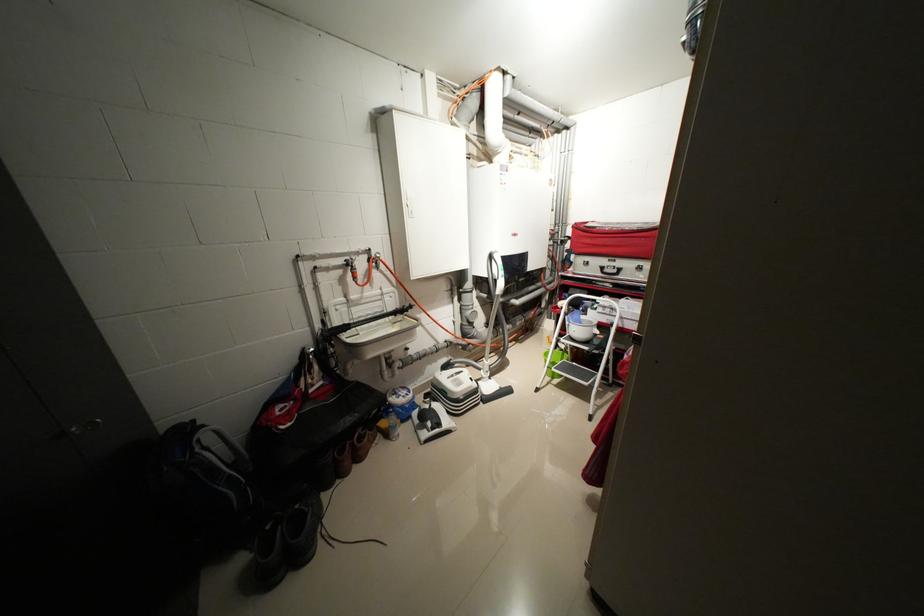
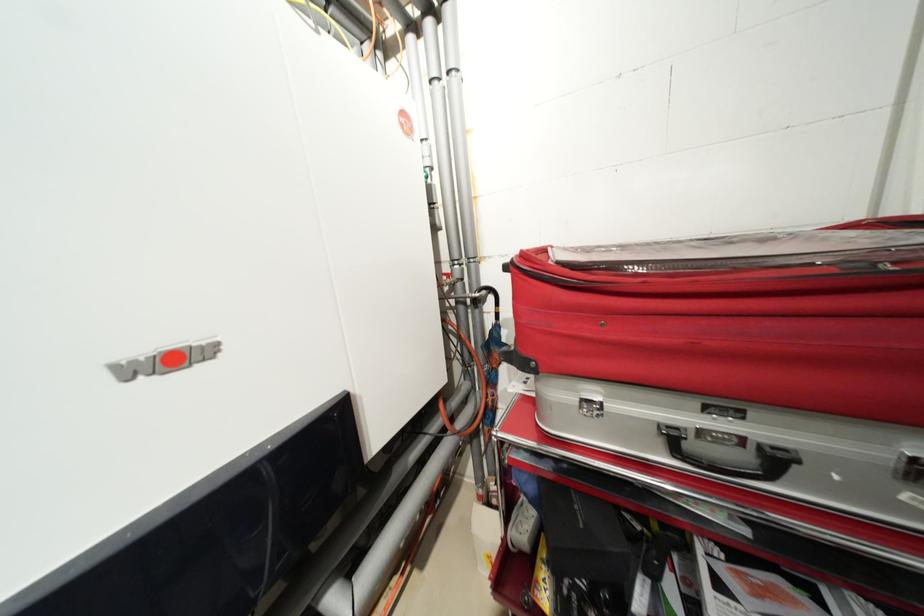
Which direction would the cameraman need to move to produce the second image?

The cameraman walked toward right, forward.